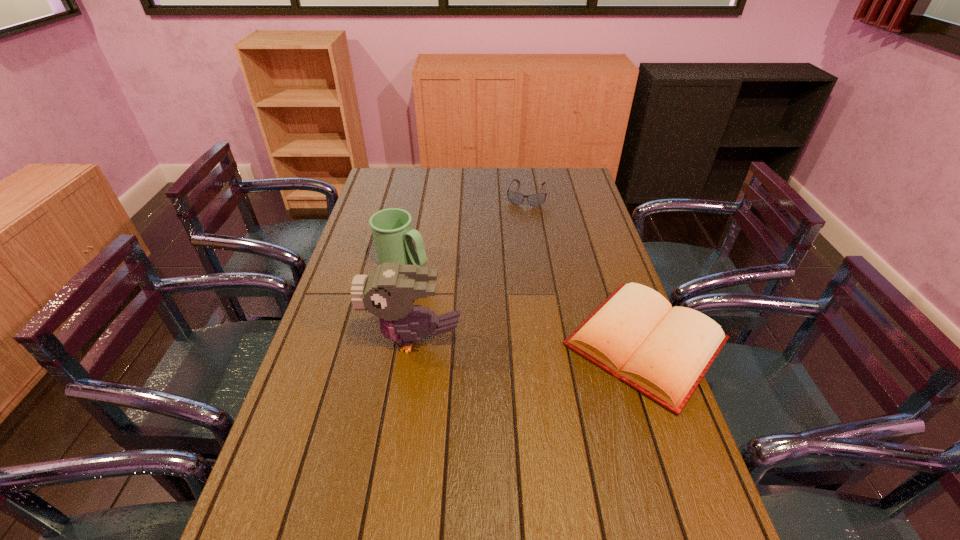
Where is `vacant position located 0.250m on the lenses of the sunglasses`? This screenshot has height=540, width=960. vacant position located 0.250m on the lenses of the sunglasses is located at coordinates (517, 245).

You are a GUI agent. You are given a task and a screenshot of the screen. Output one action in this format:
    pyautogui.click(x=<x>, y=<y>)
    Task: Click on the vacant space located on the lenses of the sunglasses
    This screenshot has width=960, height=540.
    Given the screenshot: What is the action you would take?
    pos(519,232)

This screenshot has width=960, height=540. I want to click on vacant area located on the side of the second tallest object with the handle, so [x=471, y=295].

Locate an element on the screen. free spot located on the side of the second tallest object with the handle is located at coordinates (515, 317).

Locate an element on the screen. This screenshot has height=540, width=960. vacant space located 0.350m on the side of the second tallest object with the handle is located at coordinates (512, 316).

Image resolution: width=960 pixels, height=540 pixels. I want to click on object located in the far edge section of the desktop, so click(x=516, y=198).

This screenshot has width=960, height=540. In order to click on bird that is at the left edge in this screenshot , I will do `click(389, 292)`.

This screenshot has width=960, height=540. Identify the location of mug at the left edge. (393, 236).

Locate an element on the screen. object that is at the right edge is located at coordinates (663, 352).

This screenshot has width=960, height=540. I want to click on free space at the far edge of the desktop, so click(471, 175).